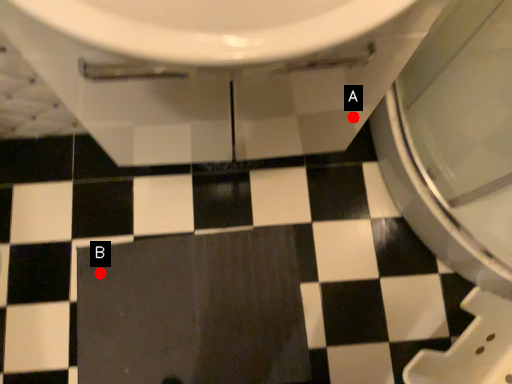
Question: Two points are circled on the image, labeled by A and B beside each circle. Which of the following is the farthest from the observer?

Choices:
 (A) A is further
 (B) B is further

Answer: (B)